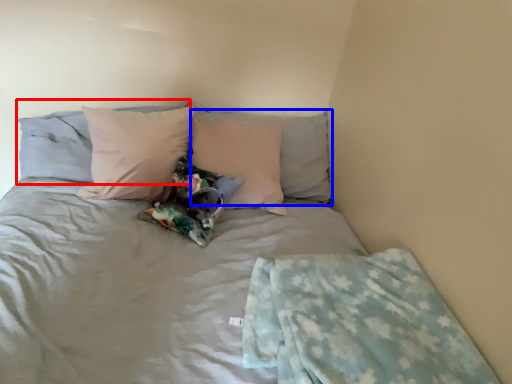
Question: Which point is closer to the camera, pillow (highlighted by a red box) or pillow (highlighted by a blue box)?

Choices:
 (A) pillow
 (B) pillow

Answer: (A)